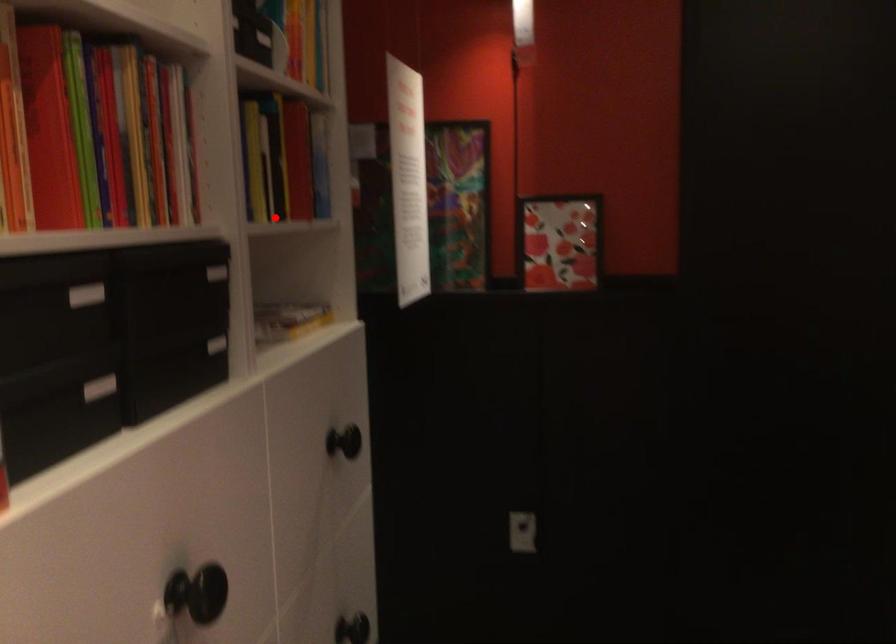
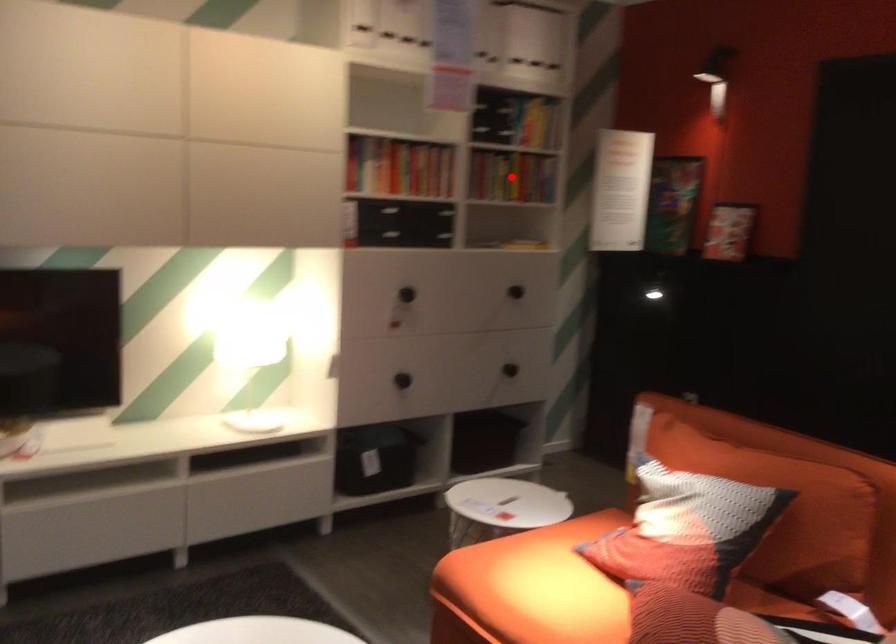
I am providing you with two images of the same scene from different viewpoints. A red point is marked on the first image and another point is marked on the second image. Do the highlighted points in image1 and image2 indicate the same real-world spot?

Yes